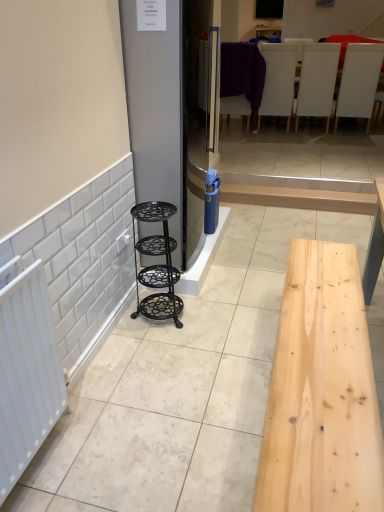
Question: Is white leather chairs at upper center, which is the 3th furniture in right-to-left order, looking in the opposite direction of white matte chair at upper center, positioned as the 3th furniture in back-to-front order?

Choices:
 (A) yes
 (B) no

Answer: (B)

Question: Does white leather chairs at upper center, the fourth furniture in the front-to-back sequence, come behind white matte chair at upper center, which is counted as the 3th furniture, starting from the front?

Choices:
 (A) no
 (B) yes

Answer: (B)

Question: Does white leather chairs at upper center, the fourth furniture in the front-to-back sequence, appear on the right side of white matte chair at upper center, positioned as the 2th furniture in right-to-left order?

Choices:
 (A) yes
 (B) no

Answer: (B)

Question: Is white leather chairs at upper center, which is the 3th furniture from left to right, next to white matte chair at upper center, the 4th furniture positioned from the left?

Choices:
 (A) yes
 (B) no

Answer: (B)

Question: Does white leather chairs at upper center, which is the 3th furniture from left to right, come in front of white matte chair at upper center, positioned as the 3th furniture in back-to-front order?

Choices:
 (A) no
 (B) yes

Answer: (A)

Question: From a real-world perspective, is purple fabric chair at upper center, the fourth furniture positioned from the right, positioned above or below white matte chair at upper right, which ranks as the first furniture in right-to-left order?

Choices:
 (A) above
 (B) below

Answer: (B)

Question: In the image, is purple fabric chair at upper center, the first furniture from the back, on the left side or the right side of white matte chair at upper right, the fourth furniture from the back?

Choices:
 (A) left
 (B) right

Answer: (A)

Question: From the image's perspective, relative to white matte chair at upper right, the fourth furniture from the back, is purple fabric chair at upper center, the second furniture when ordered from left to right, above or below?

Choices:
 (A) above
 (B) below

Answer: (A)

Question: Is purple fabric chair at upper center, the second furniture when ordered from left to right, inside the boundaries of white matte chair at upper right, which ranks as the first furniture in right-to-left order, or outside?

Choices:
 (A) outside
 (B) inside

Answer: (A)

Question: In terms of width, does white matte chair at upper center, positioned as the 3th furniture in back-to-front order, look wider or thinner when compared to satin silver fridge at center?

Choices:
 (A) thin
 (B) wide

Answer: (A)

Question: Considering their positions, is white matte chair at upper center, which is counted as the 3th furniture, starting from the front, located in front of or behind satin silver fridge at center?

Choices:
 (A) front
 (B) behind

Answer: (B)

Question: Is white matte chair at upper center, the 4th furniture positioned from the left, inside the boundaries of satin silver fridge at center, or outside?

Choices:
 (A) inside
 (B) outside

Answer: (B)

Question: Does point (316, 70) appear closer or farther from the camera than point (183, 240)?

Choices:
 (A) farther
 (B) closer

Answer: (A)

Question: Considering the positions of white matte radiator at left and satin silver fridge at center in the image, is white matte radiator at left bigger or smaller than satin silver fridge at center?

Choices:
 (A) small
 (B) big

Answer: (A)

Question: Considering the positions of white matte radiator at left and satin silver fridge at center in the image, is white matte radiator at left wider or thinner than satin silver fridge at center?

Choices:
 (A) wide
 (B) thin

Answer: (B)